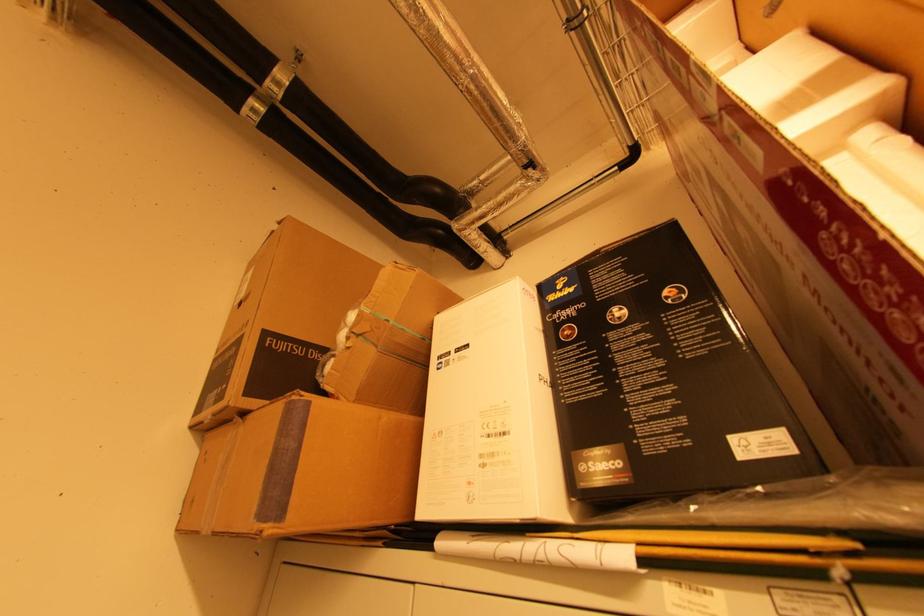
Find the location of `white styrofoam block`. white styrofoam block is located at coordinates (849, 132).